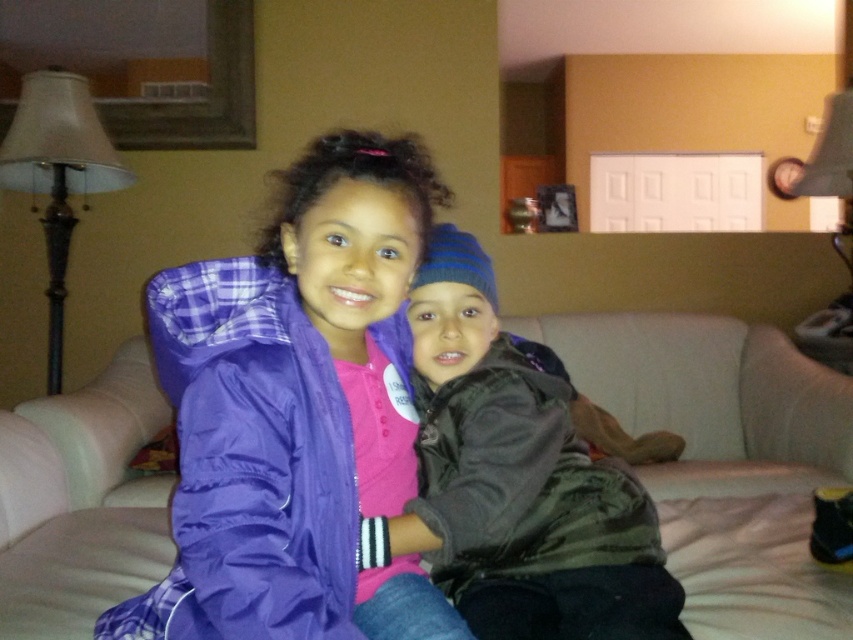
Question: Which object is closer to the camera taking this photo?

Choices:
 (A) beige fabric couch at center
 (B) black matte jacket at center
 (C) purple matte jacket at center
 (D) dark gray fleece jacket at center

Answer: (C)

Question: Estimate the real-world distances between objects in this image. Which object is farther from the dark gray fleece jacket at center?

Choices:
 (A) black matte jacket at center
 (B) purple matte jacket at center
 (C) beige fabric couch at center

Answer: (C)

Question: Does dark gray fleece jacket at center have a smaller size compared to black matte jacket at center?

Choices:
 (A) no
 (B) yes

Answer: (A)

Question: Is purple matte jacket at center above beige fabric couch at center?

Choices:
 (A) yes
 (B) no

Answer: (A)

Question: Which point is closer to the camera taking this photo?

Choices:
 (A) (38, 490)
 (B) (497, 481)
 (C) (380, 300)
 (D) (457, 577)

Answer: (C)

Question: In this image, where is beige fabric couch at center located relative to dark gray fleece jacket at center?

Choices:
 (A) right
 (B) left

Answer: (A)